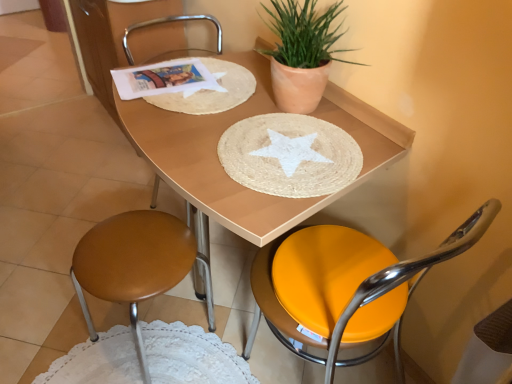
Identify the location of vacant space in front of terracotta clay pot at upper right. (296, 148).